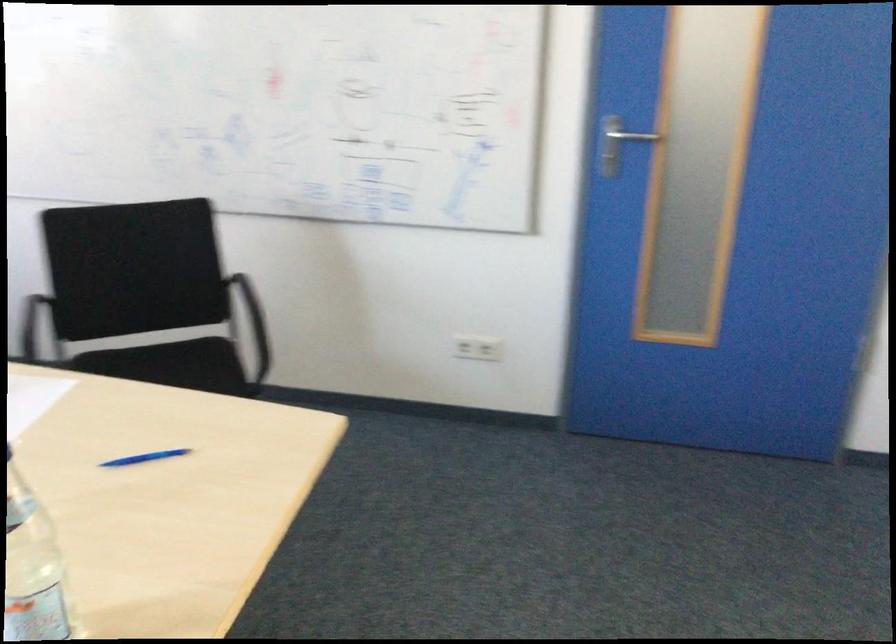
Where would you sit the chair sitting surface? Please return your answer as a coordinate pair (x, y).

(194, 364)